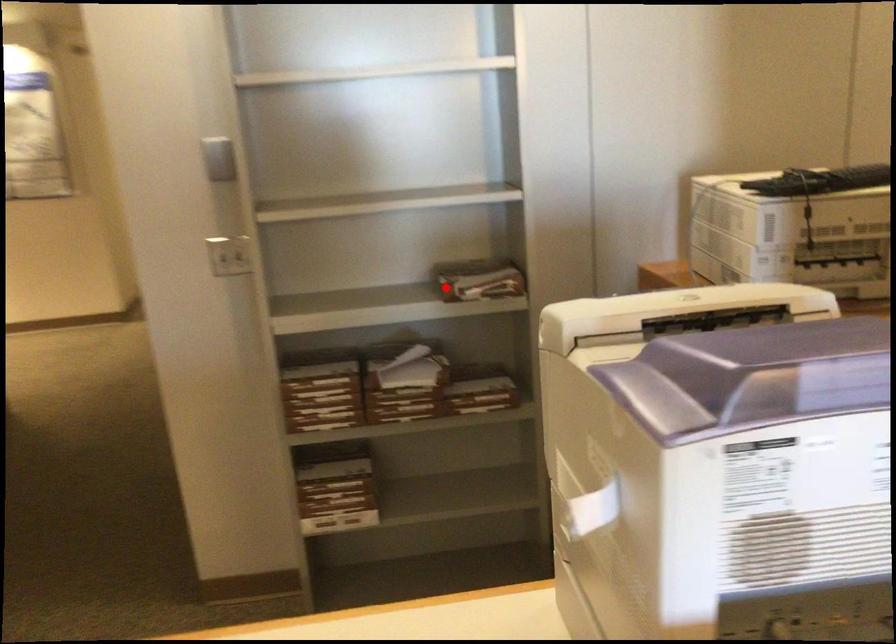
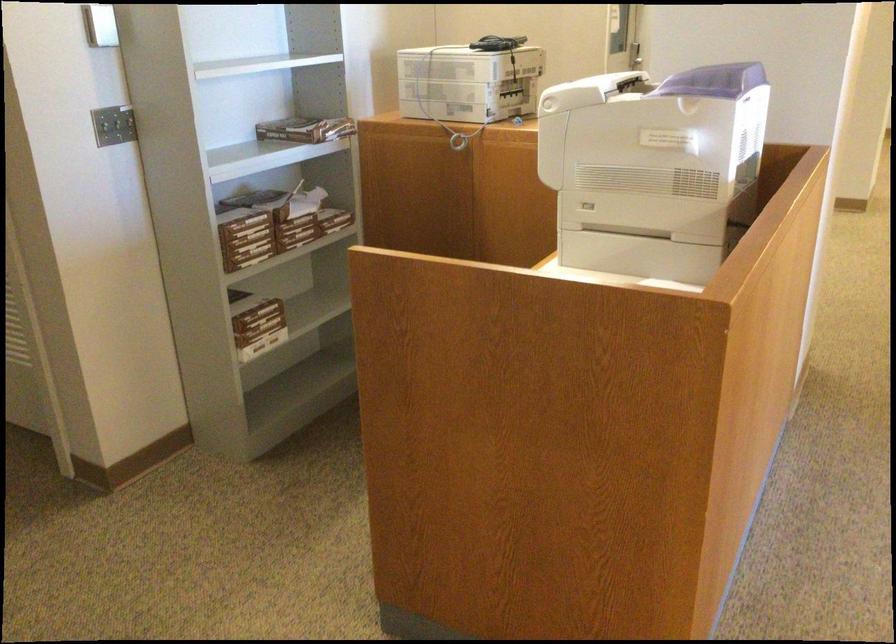
In the second image, find the point that corresponds to the highlighted location in the first image.

(306, 129)